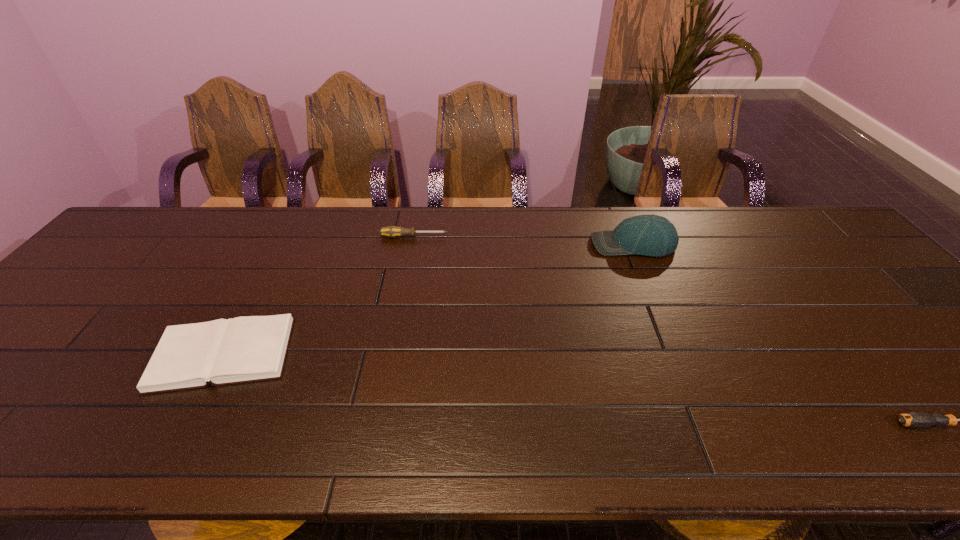
Locate an element on the screen. the second object from right to left is located at coordinates (650, 235).

Where is `the tallest object`? This screenshot has height=540, width=960. the tallest object is located at coordinates (650, 235).

You are a GUI agent. You are given a task and a screenshot of the screen. Output one action in this format:
    pyautogui.click(x=<x>, y=<y>)
    Task: Click on the taller screwdriver
    The image size is (960, 540).
    Given the screenshot: What is the action you would take?
    pyautogui.click(x=391, y=231)

Identify the location of the farther screwdriver. This screenshot has width=960, height=540. (391, 231).

At what (x,y) coordinates should I click in order to perform the action: click on the second nearest object. Please return your answer as a coordinate pair (x, y). The height and width of the screenshot is (540, 960). Looking at the image, I should click on (247, 349).

The width and height of the screenshot is (960, 540). I want to click on the leftmost object, so click(x=247, y=349).

I want to click on vacant space situated 0.210m on the front of the tallest object, so click(661, 312).

The width and height of the screenshot is (960, 540). Identify the location of vacant position located 0.390m at the tip of the left screwdriver. (574, 237).

Locate an element on the screen. The image size is (960, 540). vacant space located 0.060m on the left of the leftmost object is located at coordinates click(x=130, y=354).

You are a GUI agent. You are given a task and a screenshot of the screen. Output one action in this format:
    pyautogui.click(x=<x>, y=<y>)
    Task: Click on the baseball cap situated at the far edge
    This screenshot has height=540, width=960.
    Given the screenshot: What is the action you would take?
    pyautogui.click(x=650, y=235)